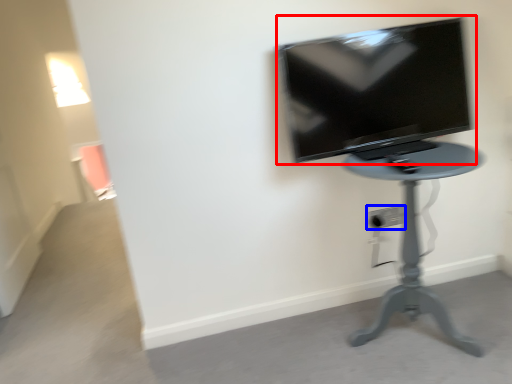
Question: Among these objects, which one is nearest to the camera, television (highlighted by a red box) or electric outlet (highlighted by a blue box)?

Choices:
 (A) television
 (B) electric outlet

Answer: (A)